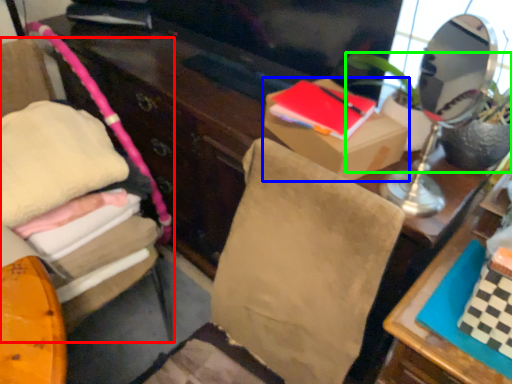
Question: Estimate the real-world distances between objects in this image. Which object is farther from furniture (highlighted by a red box), box (highlighted by a blue box) or houseplant (highlighted by a green box)?

Choices:
 (A) box
 (B) houseplant

Answer: (B)